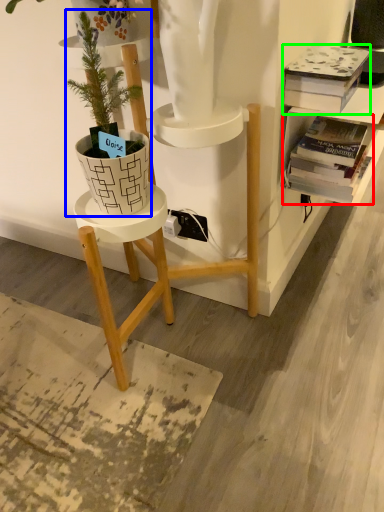
Question: Based on their relative distances, which object is nearer to book (highlighted by a red box)? Choose from houseplant (highlighted by a blue box) and book (highlighted by a green box).

Choices:
 (A) houseplant
 (B) book

Answer: (B)